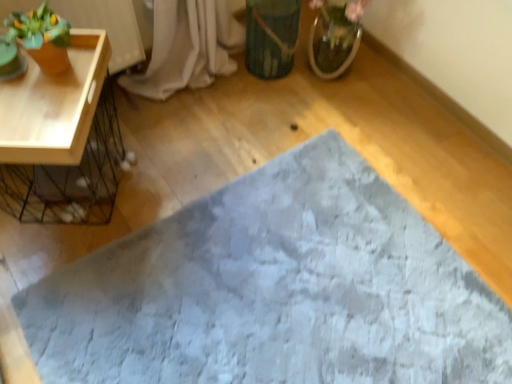
Question: Considering their positions, is gray textured bath mat at center located in front of or behind green matte vase at center?

Choices:
 (A) front
 (B) behind

Answer: (A)

Question: Is gray textured bath mat at center inside or outside of green matte vase at center?

Choices:
 (A) inside
 (B) outside

Answer: (B)

Question: Estimate the real-world distances between objects in this image. Which object is farther from the gray textured bath mat at center?

Choices:
 (A) matte orange pot at upper left
 (B) green matte vase at center

Answer: (A)

Question: Based on their relative distances, which object is nearer to the gray textured bath mat at center?

Choices:
 (A) green matte vase at center
 (B) matte orange pot at upper left

Answer: (A)